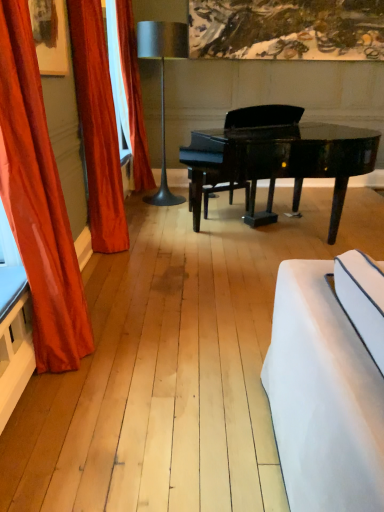
Identify the location of free space in front of satin orange curtain at left, the 1th curtain positioned from the front. The width and height of the screenshot is (384, 512). (79, 407).